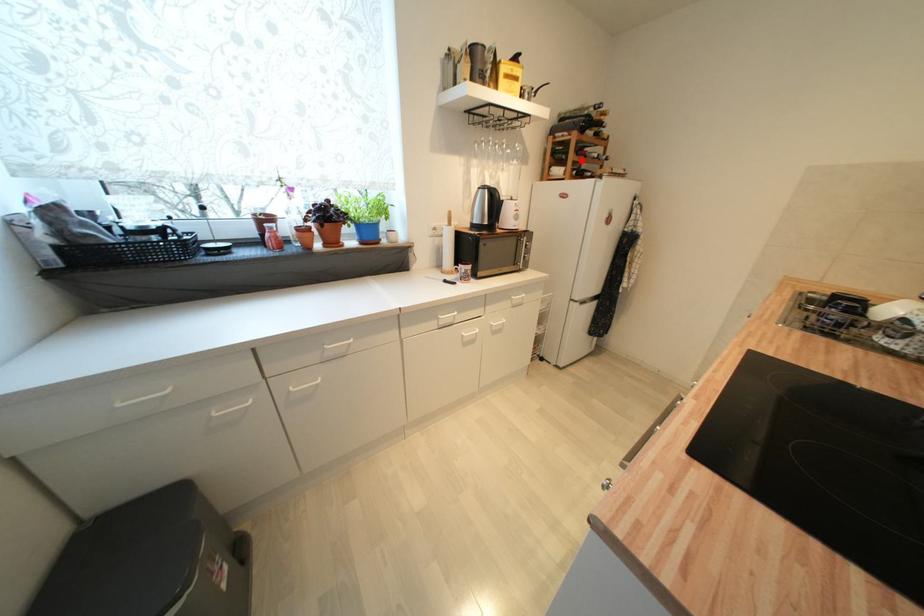
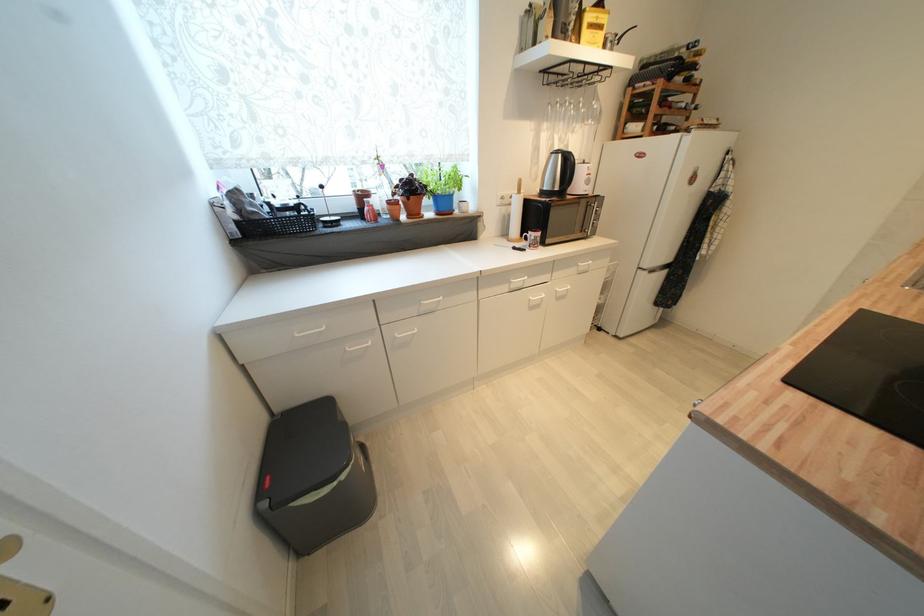
Question: I am providing you with two images of the same scene from different viewpoints. In image1, a red point is highlighted. Considering the same 3D point in image2, which of the following is correct?

Choices:
 (A) It is closer
 (B) It is farther

Answer: (B)